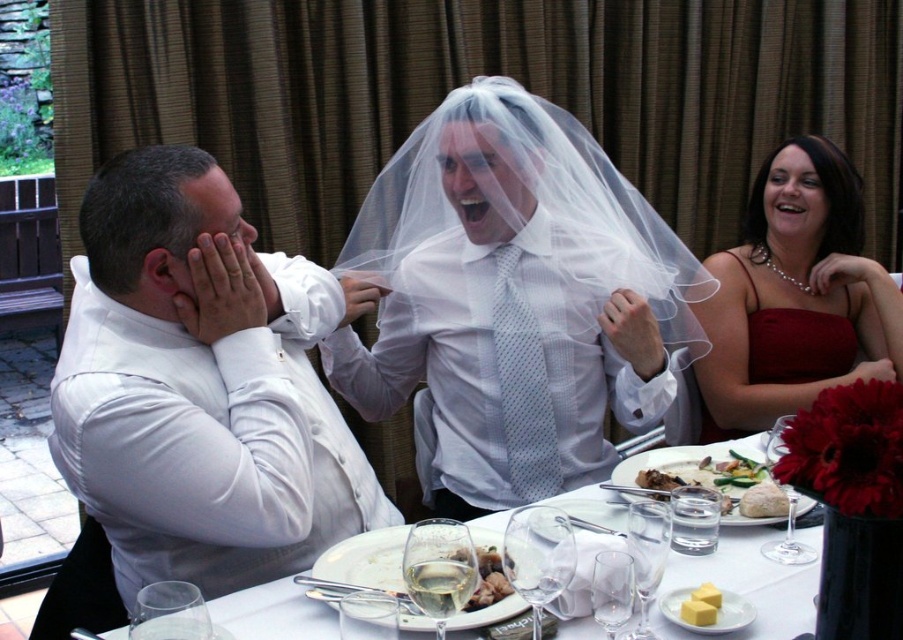
Question: Which is nearer to the white porcelain plate at center?

Choices:
 (A) white creamy mashed potatoes at lower center
 (B) white satin shirt at left
 (C) golden brown bread at center
 (D) matte burgundy satin dress at right

Answer: (B)

Question: Which is farther from the matte red dress at upper right?

Choices:
 (A) white glossy plate at center
 (B) white satin shirt at left

Answer: (B)

Question: Can you confirm if white satin shirt at left is thinner than matte burgundy satin dress at right?

Choices:
 (A) yes
 (B) no

Answer: (B)

Question: Which is nearer to the matte burgundy satin dress at right?

Choices:
 (A) golden brown bread at center
 (B) white porcelain plate at center
 (C) white satin shirt at left

Answer: (A)

Question: Is white satin shirt at left to the left of golden brown bread at center from the viewer's perspective?

Choices:
 (A) no
 (B) yes

Answer: (B)

Question: Is white glossy plate at center bigger than golden brown bread at center?

Choices:
 (A) yes
 (B) no

Answer: (A)